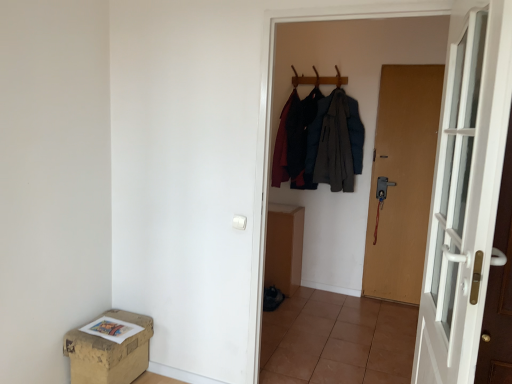
Question: From the image's perspective, is wooden coat hanger at upper center below brown tile at center?

Choices:
 (A) no
 (B) yes

Answer: (A)

Question: Is wooden coat hanger at upper center outside brown tile at center?

Choices:
 (A) yes
 (B) no

Answer: (A)

Question: Considering the relative positions of wooden coat hanger at upper center and brown tile at center in the image provided, is wooden coat hanger at upper center to the right of brown tile at center from the viewer's perspective?

Choices:
 (A) yes
 (B) no

Answer: (A)

Question: Does wooden coat hanger at upper center have a lesser width compared to brown tile at center?

Choices:
 (A) yes
 (B) no

Answer: (A)

Question: Is wooden coat hanger at upper center looking in the opposite direction of brown tile at center?

Choices:
 (A) no
 (B) yes

Answer: (A)

Question: Is wooden coat hanger at upper center not close to brown tile at center?

Choices:
 (A) no
 (B) yes

Answer: (B)

Question: From a real-world perspective, is white glass door at right, which ranks as the second door in right-to-left order, physically below brown matte door at right, arranged as the first door when viewed from the right?

Choices:
 (A) no
 (B) yes

Answer: (A)

Question: Is brown matte door at right, arranged as the first door when viewed from the right, at the back of white glass door at right, which ranks as the second door in right-to-left order?

Choices:
 (A) yes
 (B) no

Answer: (B)

Question: Is brown matte door at right, arranged as the first door when viewed from the right, located within white glass door at right, which ranks as the second door in right-to-left order?

Choices:
 (A) no
 (B) yes

Answer: (A)

Question: Is white glass door at right, acting as the 1th door starting from the left, smaller than brown matte door at right, the second door viewed from the front?

Choices:
 (A) no
 (B) yes

Answer: (A)

Question: Is white glass door at right, which is the first door from front to back, aimed at brown matte door at right, arranged as the first door when viewed from the right?

Choices:
 (A) no
 (B) yes

Answer: (A)

Question: Is white glass door at right, which is the first door from front to back, beside brown matte door at right, the second door positioned from the left?

Choices:
 (A) no
 (B) yes

Answer: (A)

Question: Is brown cardboard box at lower left outside of brown matte door at right, the second door viewed from the front?

Choices:
 (A) yes
 (B) no

Answer: (A)